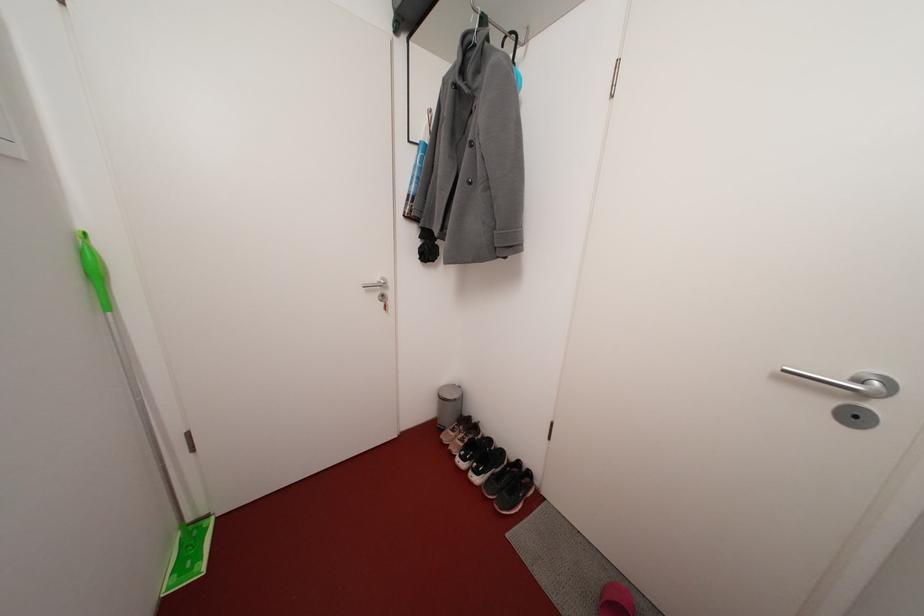
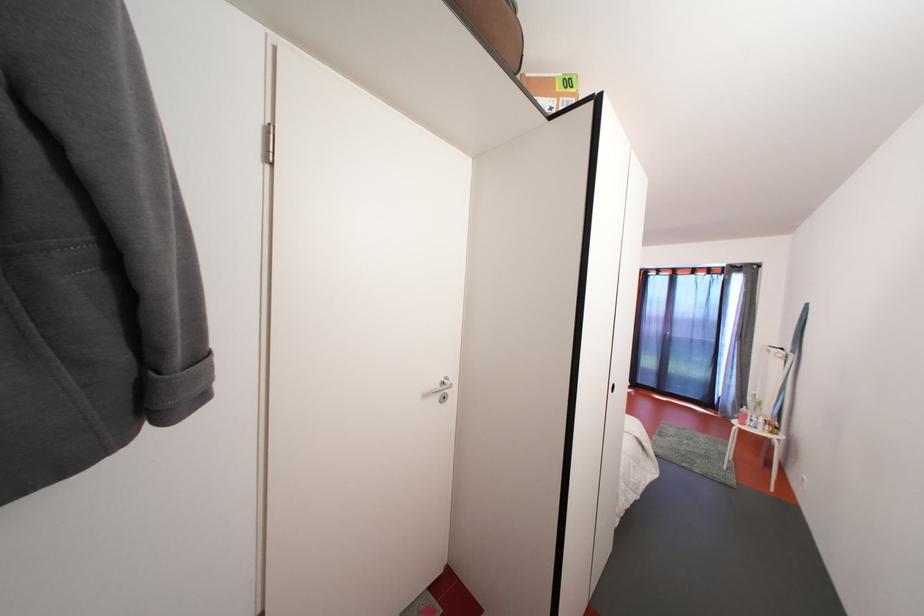
Question: The camera is either moving clockwise (left) or counter-clockwise (right) around the object. The first image is from the beginning of the video and the second image is from the end. Is the camera moving left or right when shooting the video?

Choices:
 (A) Left
 (B) Right

Answer: (A)